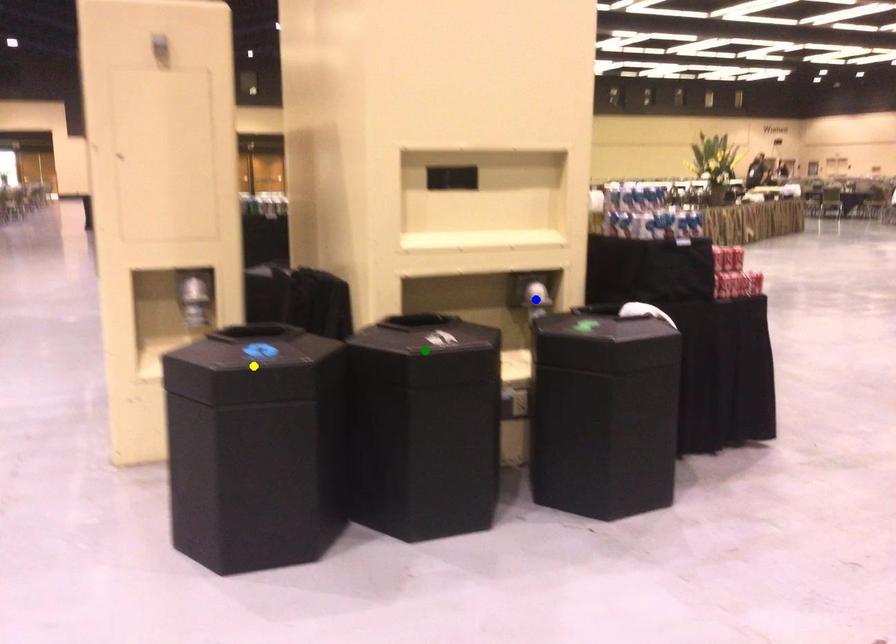
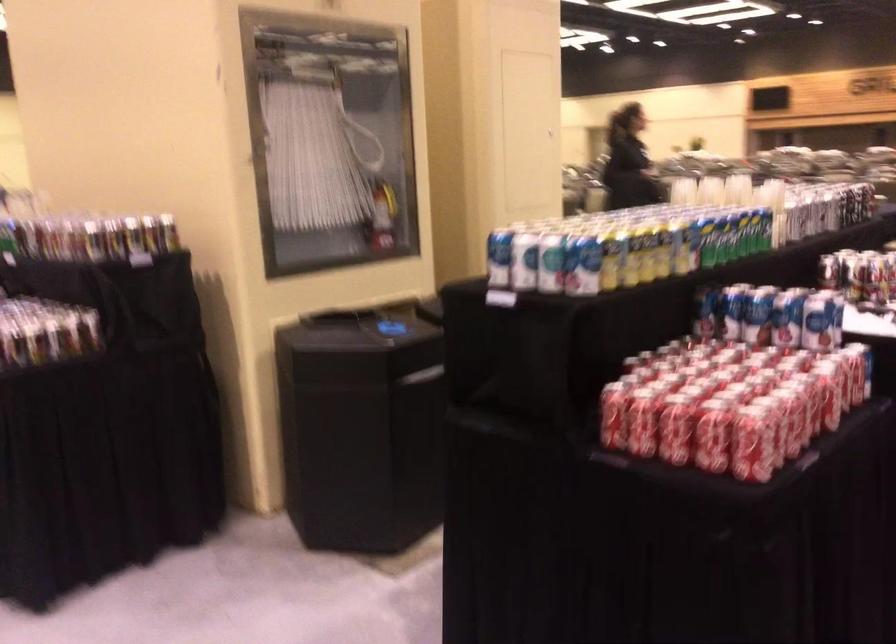
I am providing you with two images of the same scene from different viewpoints. Three points are marked in image1. Which point corresponds to a part or object that is occluded in image2?In image1, three points are marked. Which of them correspond to a part or object that is occluded in image2?Among the three points shown in image1, which one corresponds to a part or object that is no longer visible due to occlusion in image2?

green point, yellow point, blue point